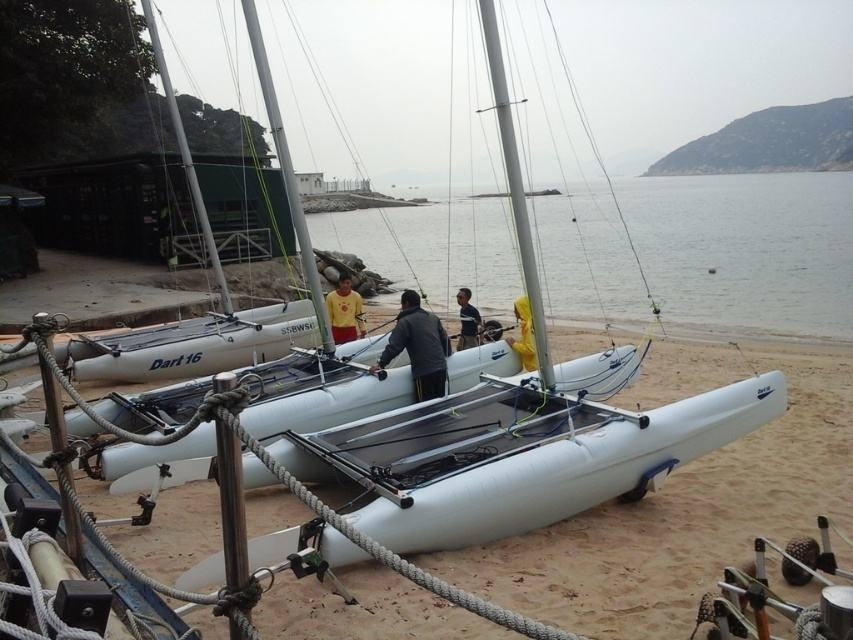
You are standing on the beach looking at the scene. Which object, the white matte water at center or the white matte sailboat at center, is closer to you?

The white matte water at center is closer to you because the white matte sailboat at center is behind it.

You are standing on the beach and see the point marked at coordinates (747, 250). What is the surface type at that point?

The point at coordinates (747, 250) is on white matte water at center.